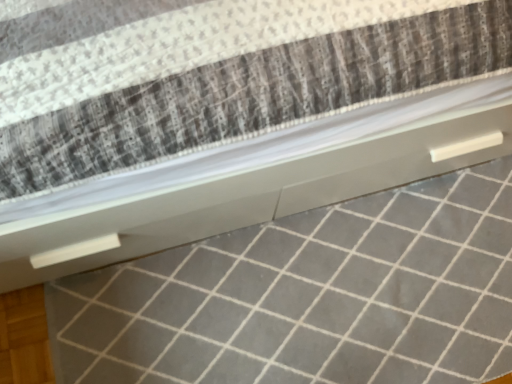
Question: Is point (143, 317) positioned closer to the camera than point (322, 66)?

Choices:
 (A) farther
 (B) closer

Answer: (A)

Question: Considering the positions of white glossy tile at center and white textured mattress at center in the image, is white glossy tile at center wider or thinner than white textured mattress at center?

Choices:
 (A) thin
 (B) wide

Answer: (A)

Question: From a real-world perspective, is white glossy tile at center positioned above or below white textured mattress at center?

Choices:
 (A) above
 (B) below

Answer: (B)

Question: Considering the relative positions of white textured mattress at center and white glossy tile at center in the image provided, is white textured mattress at center to the left or to the right of white glossy tile at center?

Choices:
 (A) right
 (B) left

Answer: (B)

Question: In terms of size, does white textured mattress at center appear bigger or smaller than white glossy tile at center?

Choices:
 (A) big
 (B) small

Answer: (A)

Question: Is white textured mattress at center in front of or behind white glossy tile at center in the image?

Choices:
 (A) front
 (B) behind

Answer: (A)

Question: In terms of width, does white textured mattress at center look wider or thinner when compared to white glossy tile at center?

Choices:
 (A) thin
 (B) wide

Answer: (B)